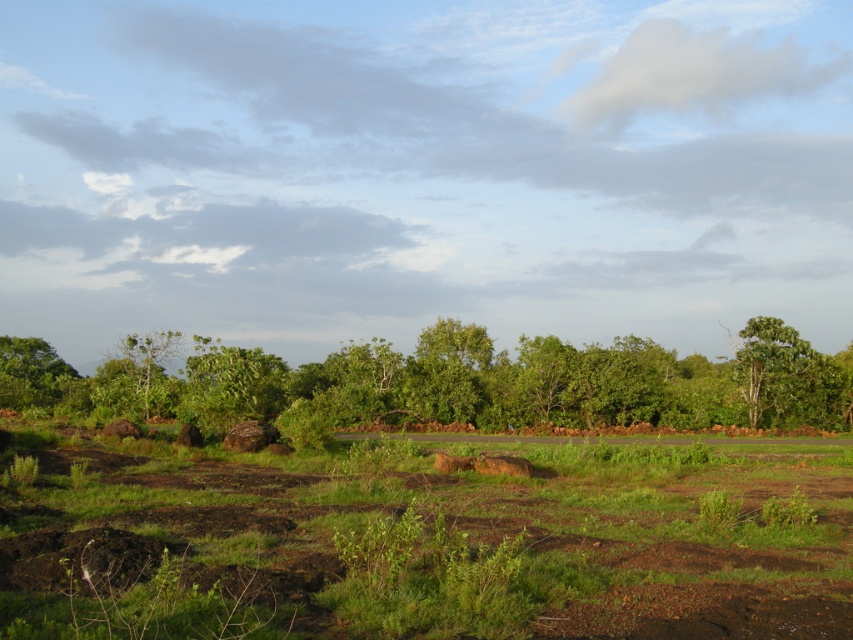
Question: Does green leafy tree at center appear on the left side of green leafy tree at left?

Choices:
 (A) yes
 (B) no

Answer: (B)

Question: Is green leafy tree at center wider than green leafy tree at left?

Choices:
 (A) no
 (B) yes

Answer: (B)

Question: Can you confirm if green leafy tree at center is smaller than green leafy tree at left?

Choices:
 (A) yes
 (B) no

Answer: (B)

Question: Which object appears closest to the camera in this image?

Choices:
 (A) green leafy tree at center
 (B) green leafy tree at left

Answer: (A)